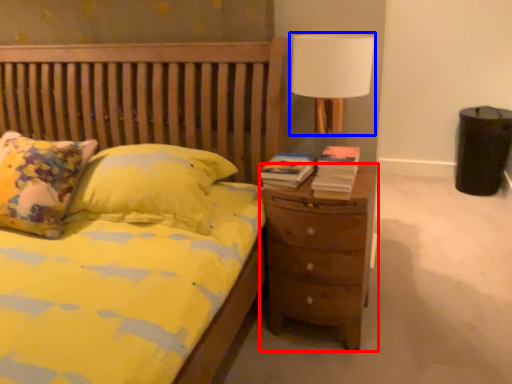
Question: Which object appears farthest to the camera in this image, nightstand (highlighted by a red box) or lamp (highlighted by a blue box)?

Choices:
 (A) nightstand
 (B) lamp

Answer: (A)